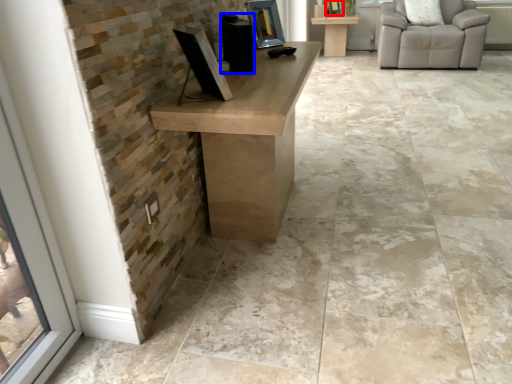
Question: Which of the following is the closest to the observer, picture frame (highlighted by a red box) or speaker (highlighted by a blue box)?

Choices:
 (A) picture frame
 (B) speaker

Answer: (B)